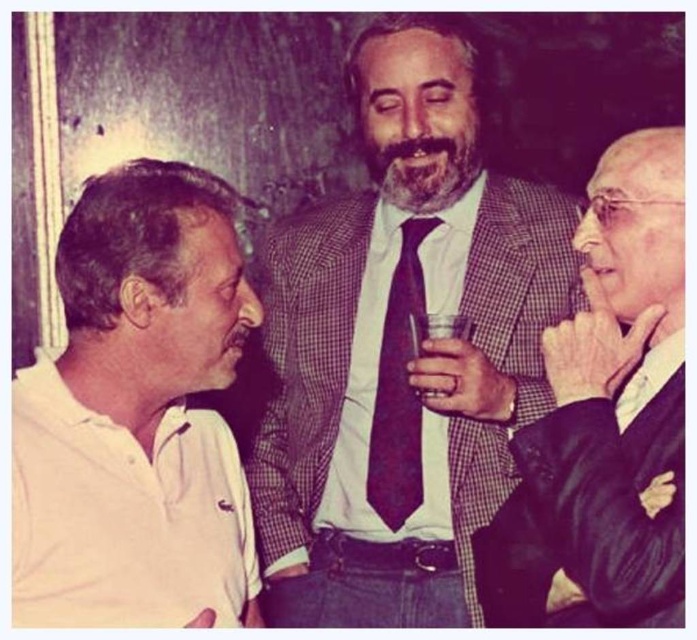
From the picture: You are standing in the room where the three men are conversing. If you face the man in the checkered blazer, which direction should you turn to look at the white cotton polo shirt at left?

Since the white cotton polo shirt at left is positioned at point (x=135, y=412), you should turn to your left to face the man wearing the white cotton polo shirt at left.

You are at a social event and see the checkered wool suit at center and the white cotton polo shirt at left. Which clothing item is positioned to the right of the other?

The checkered wool suit at center is to the right of the white cotton polo shirt at left.